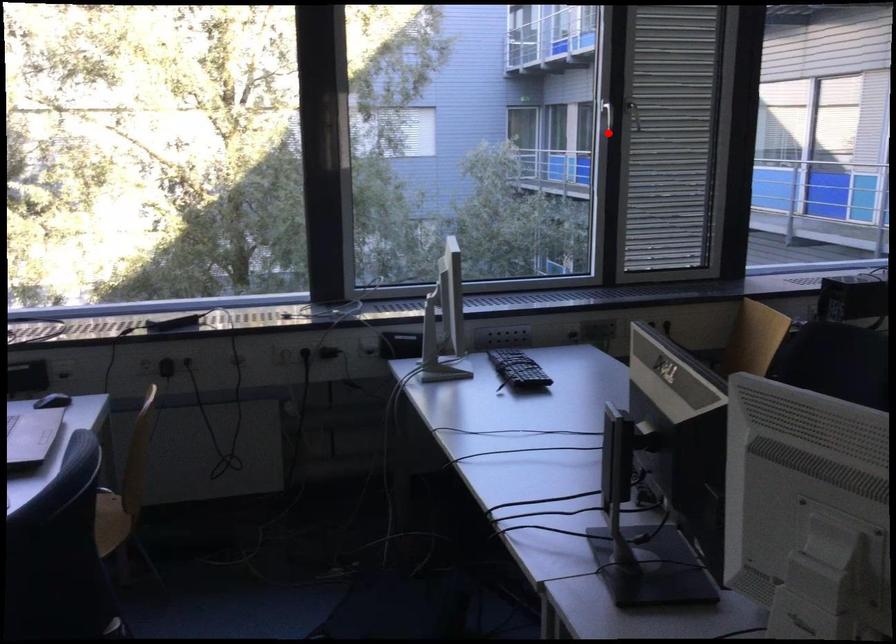
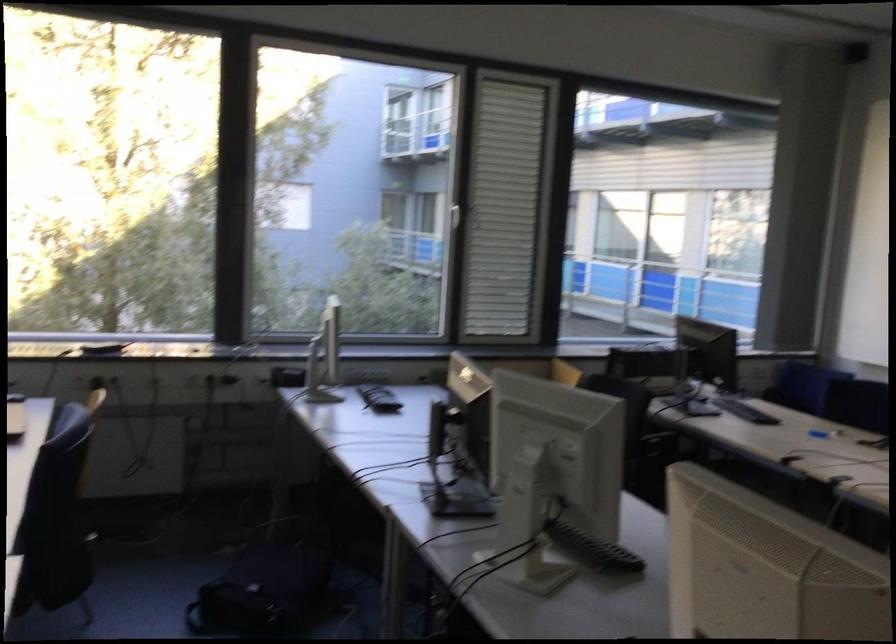
In the second image, find the point that corresponds to the highlighted location in the first image.

(453, 216)